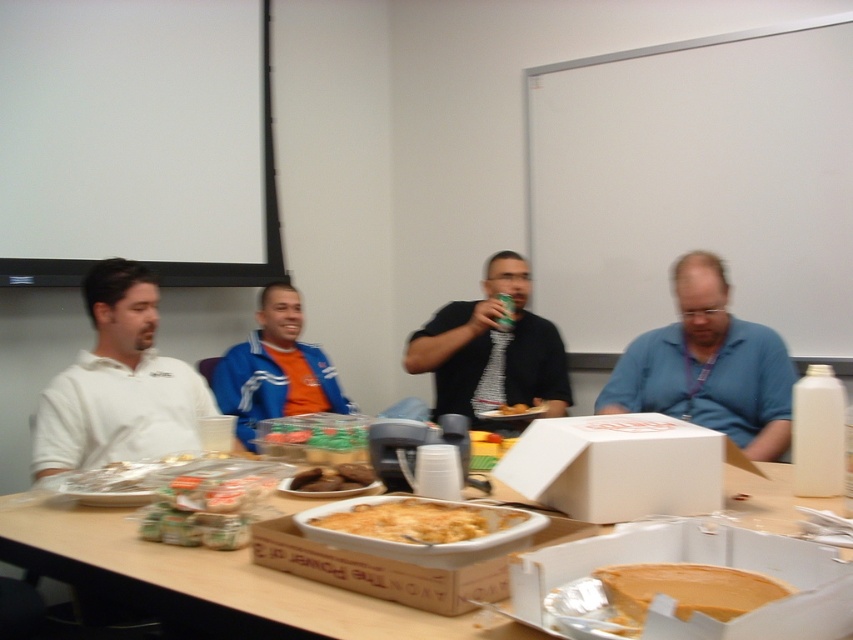
Question: Which object is farther from the camera taking this photo?

Choices:
 (A) white matte projection screen at upper left
 (B) white cardboard box at center
 (C) brown matte cookies at center

Answer: (A)

Question: Among these objects, which one is nearest to the camera?

Choices:
 (A) white matte shirt at left
 (B) brown matte cookies at center

Answer: (B)

Question: Based on their relative distances, which object is farther from the smooth peanut butter at center?

Choices:
 (A) golden brown cheesy casserole at center
 (B) white matte shirt at left
 (C) blue fabric jacket at center

Answer: (C)

Question: Does white matte shirt at left appear on the left side of blue fabric jacket at center?

Choices:
 (A) no
 (B) yes

Answer: (B)

Question: Does golden brown cheesy casserole at center have a larger size compared to brown matte cookies at center?

Choices:
 (A) yes
 (B) no

Answer: (A)

Question: Is blue fabric jacket at center smaller than yellow cake at center?

Choices:
 (A) no
 (B) yes

Answer: (A)